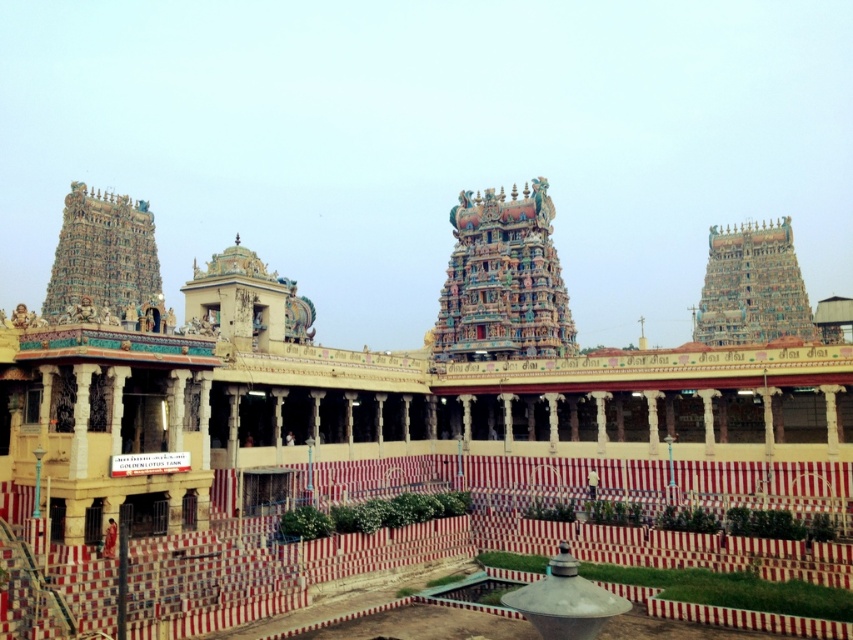
Is multicolored ornate temple at center positioned before multicolored ornate temple tower at upper right?

That is True.

Can you confirm if multicolored ornate temple at center is positioned below multicolored ornate temple tower at upper right?

Yes.

Is point (541, 257) less distant than point (759, 282)?

Yes, it is.

What are the coordinates of `multicolored ornate temple at center` in the screenshot? It's located at (503, 280).

Locate an element on the screen. The image size is (853, 640). yellow painted stone palace at center is located at coordinates (376, 385).

Looking at this image, between yellow painted stone palace at center and multicolored ornate temple at center, which one appears on the right side from the viewer's perspective?

Positioned to the right is multicolored ornate temple at center.

Image resolution: width=853 pixels, height=640 pixels. Find the location of `yellow painted stone palace at center`. yellow painted stone palace at center is located at coordinates (376, 385).

Does yellow painted stone palace at center lie behind multicolored carved temple tower at upper left?

No, yellow painted stone palace at center is closer to the viewer.

Does yellow painted stone palace at center appear on the left side of multicolored carved temple tower at upper left?

In fact, yellow painted stone palace at center is to the right of multicolored carved temple tower at upper left.

This screenshot has height=640, width=853. What are the coordinates of `yellow painted stone palace at center` in the screenshot? It's located at (376, 385).